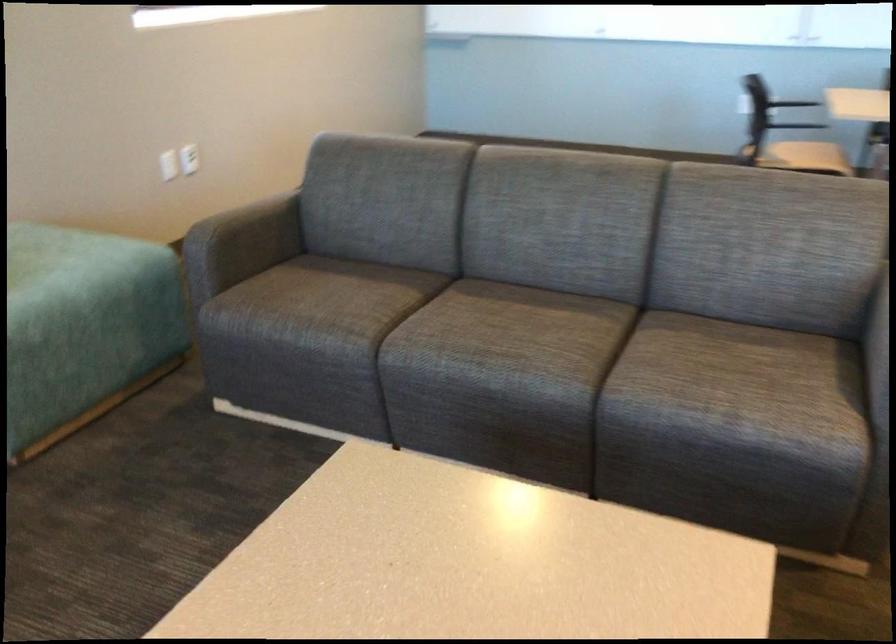
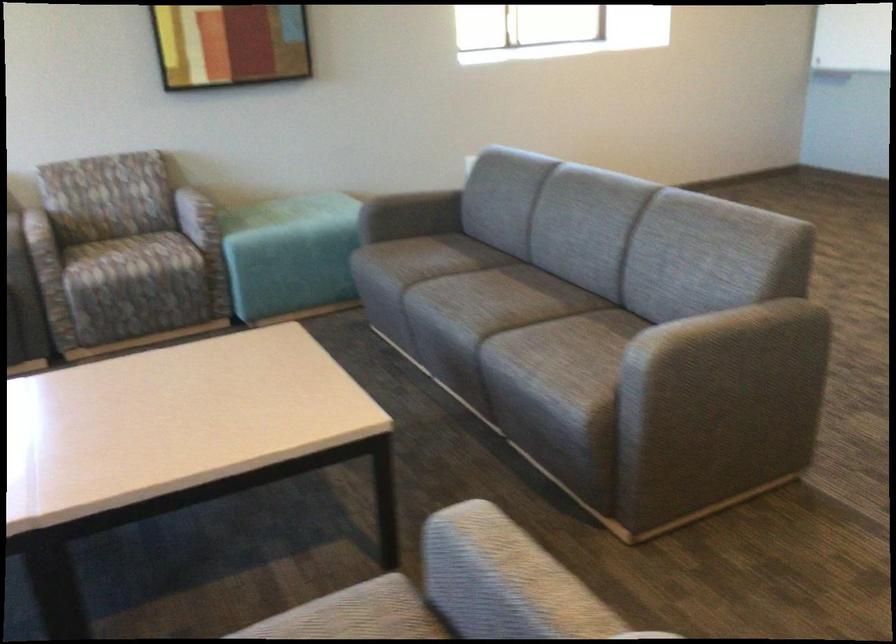
Where in the second image is the point corresponding to the point at 513,323 from the first image?

(503, 297)